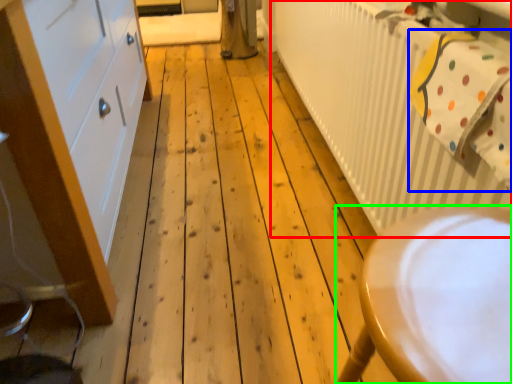
Question: Which object is the closest to the radiator (highlighted by a red box)? Choose among these: laundry (highlighted by a blue box) or furniture (highlighted by a green box).

Choices:
 (A) laundry
 (B) furniture

Answer: (A)